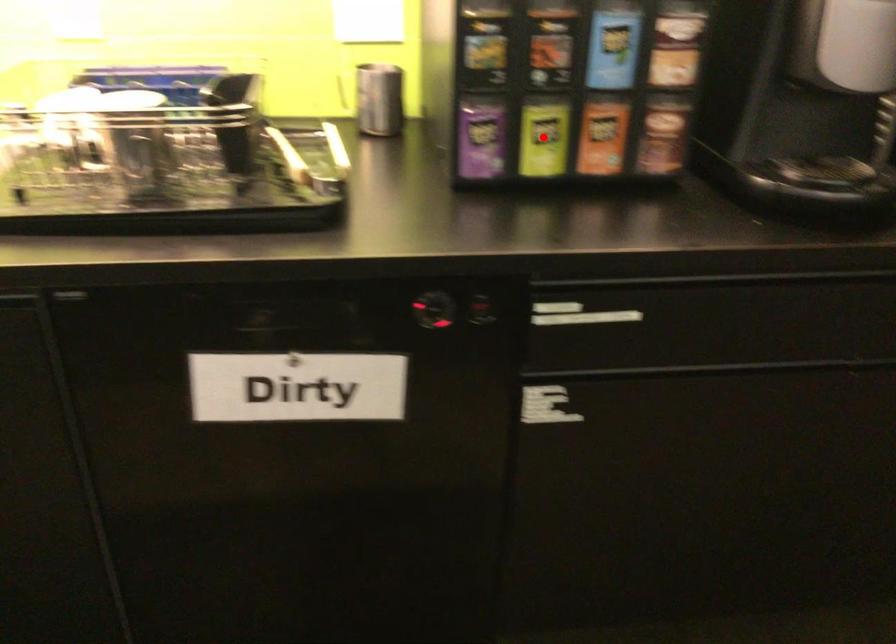
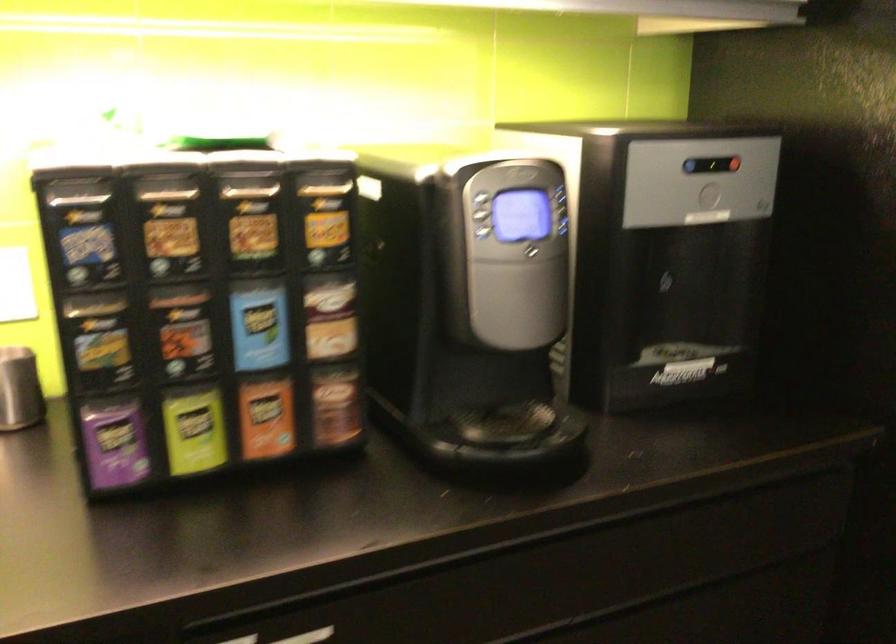
In the second image, find the point that corresponds to the highlighted location in the first image.

(194, 430)